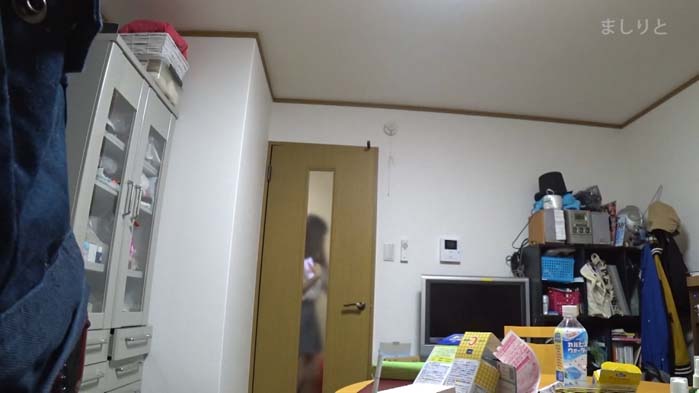
You are a GUI agent. You are given a task and a screenshot of the screen. Output one action in this format:
    pyautogui.click(x=<x>, y=<y>)
    Task: Click on the wall
    This screenshot has width=699, height=393.
    Given the screenshot: What is the action you would take?
    pyautogui.click(x=470, y=185), pyautogui.click(x=667, y=154)